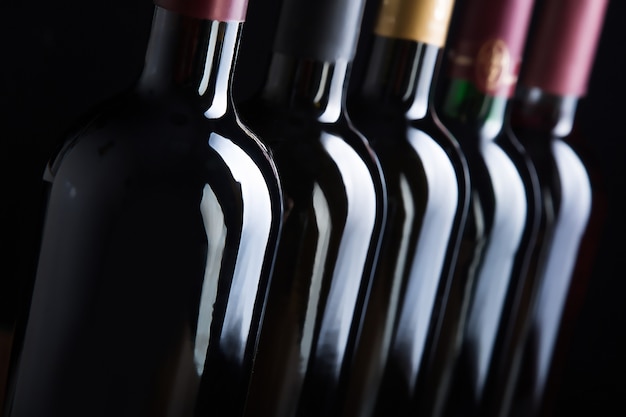
Where is `wine bottles`? wine bottles is located at coordinates (138, 292), (330, 239), (424, 216), (500, 187), (568, 198).